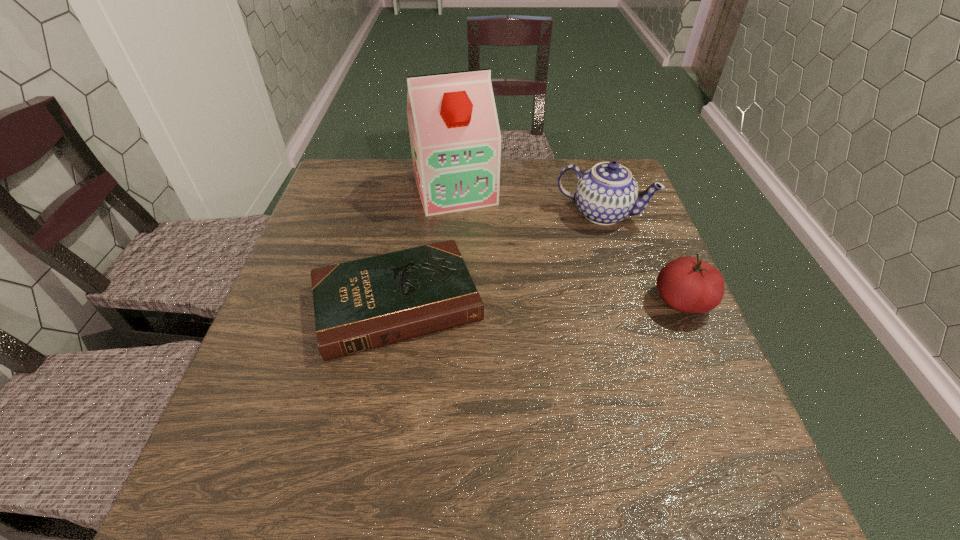
Where is `vacant space at the left edge of the desktop`? The image size is (960, 540). vacant space at the left edge of the desktop is located at coordinates (343, 257).

This screenshot has width=960, height=540. Find the location of `free space at the right edge of the desktop`. free space at the right edge of the desktop is located at coordinates (622, 259).

Where is `vacant position at the far left corner of the desktop`? The width and height of the screenshot is (960, 540). vacant position at the far left corner of the desktop is located at coordinates (370, 165).

In the image, there is a desktop. Identify the location of vacant space at the near right corner. (666, 428).

The width and height of the screenshot is (960, 540). Identify the location of free spot between the chinaware and the tomato. (642, 258).

This screenshot has width=960, height=540. What are the coordinates of `vacant area that lies between the third shortest object and the shortest object` in the screenshot? It's located at (499, 258).

The height and width of the screenshot is (540, 960). I want to click on empty location between the soya milk and the second shortest object, so click(568, 246).

The image size is (960, 540). Identify the location of free space between the shortest object and the chinaware. (499, 258).

You are a GUI agent. You are given a task and a screenshot of the screen. Output one action in this format:
    pyautogui.click(x=<x>, y=<y>)
    Task: Click on the vacant space that's between the chinaware and the tomato
    
    Given the screenshot: What is the action you would take?
    pyautogui.click(x=642, y=258)

This screenshot has width=960, height=540. I want to click on unoccupied position between the shortest object and the tomato, so click(540, 302).